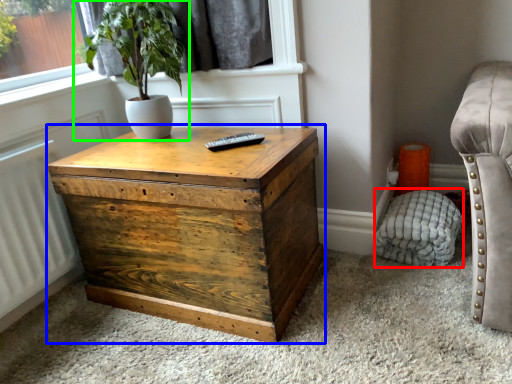
Question: Which is nearer to the swivel chair (highlighted by a red box)? nightstand (highlighted by a blue box) or houseplant (highlighted by a green box).

Choices:
 (A) nightstand
 (B) houseplant

Answer: (A)